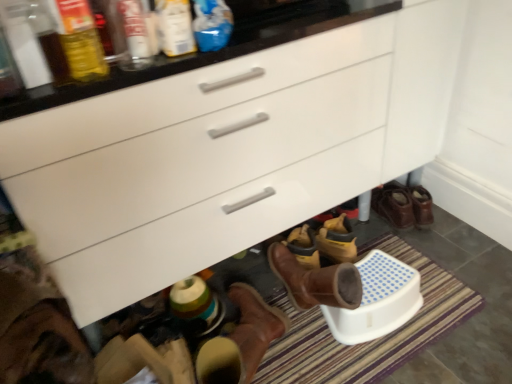
Locate an element on the screen. free space above striped carpet at lower center (from a real-world perspective) is located at coordinates (313, 341).